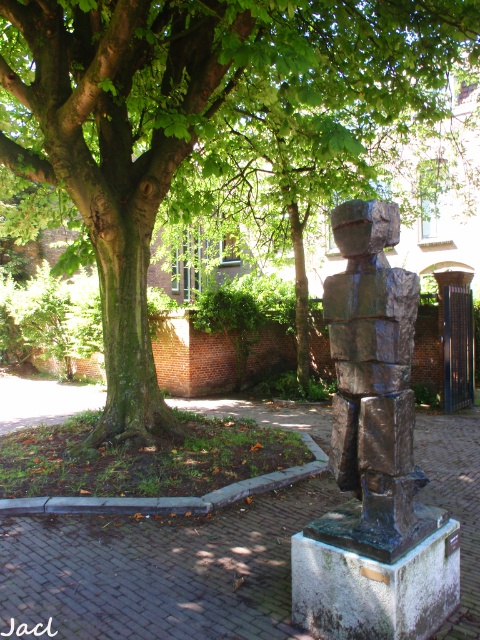
Which is above, green leafy tree at center or bronze statue at center?

Positioned higher is green leafy tree at center.

This screenshot has width=480, height=640. Find the location of `green leafy tree at center`. green leafy tree at center is located at coordinates (200, 124).

This screenshot has height=640, width=480. In order to click on green leafy tree at center in this screenshot , I will do `click(200, 124)`.